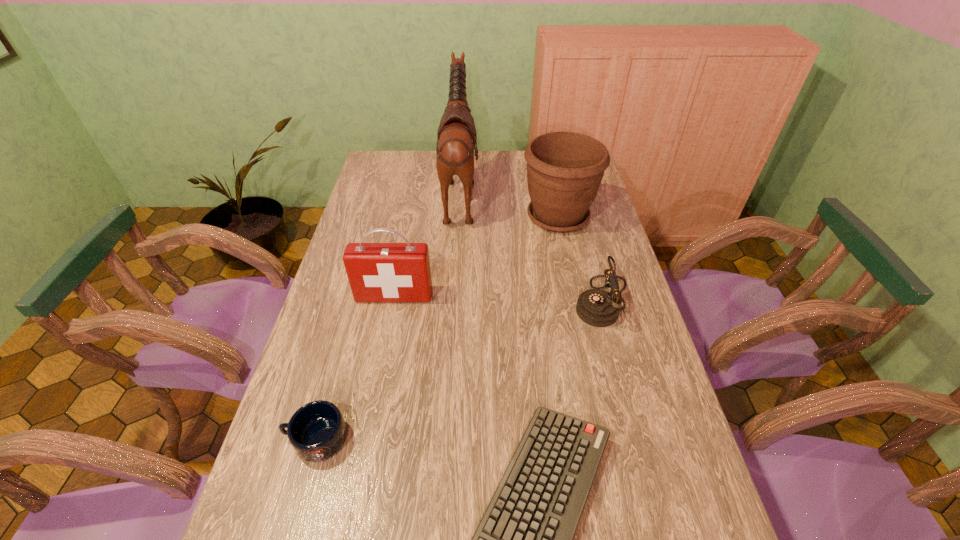
The height and width of the screenshot is (540, 960). Identify the location of free spot between the fourth tallest object and the second shortest object. (460, 370).

At what (x,y) coordinates should I click in order to perform the action: click on vacant area that lies between the third shortest object and the mug. Please return your answer as a coordinate pair (x, y). Image resolution: width=960 pixels, height=540 pixels. Looking at the image, I should click on (460, 370).

Locate an element on the screen. Image resolution: width=960 pixels, height=540 pixels. free area in between the first-aid kit and the tallest object is located at coordinates (427, 244).

At what (x,y) coordinates should I click in order to perform the action: click on the third closest object to the telephone. Please return your answer as a coordinate pair (x, y). Looking at the image, I should click on [x=456, y=137].

Locate which object ranks fourth in proximity to the fifth tallest object. Please provide its 2D coordinates. Your answer should be formatted as a tuple, i.e. [(x, y)], where the tuple contains the x and y coordinates of a point satisfying the conditions above.

[(456, 137)]

The image size is (960, 540). I want to click on vacant position in the image that satisfies the following two spatial constraints: 1. on the front face of the first-aid kit; 2. with the handle on the side of the fifth tallest object, so click(x=367, y=438).

Where is `vacant space that satisfies the following two spatial constraints: 1. on the front face of the third shortest object; 2. on the right side of the first-aid kit`? This screenshot has width=960, height=540. vacant space that satisfies the following two spatial constraints: 1. on the front face of the third shortest object; 2. on the right side of the first-aid kit is located at coordinates (393, 302).

Locate an element on the screen. free space that satisfies the following two spatial constraints: 1. on the back of the fourth tallest object; 2. on the right side of the saddle is located at coordinates (453, 302).

Locate an element on the screen. The width and height of the screenshot is (960, 540). free space that satisfies the following two spatial constraints: 1. on the front face of the third shortest object; 2. on the left side of the first-aid kit is located at coordinates pyautogui.click(x=393, y=302).

Locate an element on the screen. free space that satisfies the following two spatial constraints: 1. on the front side of the flowerpot; 2. with the handle on the side of the second shortest object is located at coordinates coord(605,438).